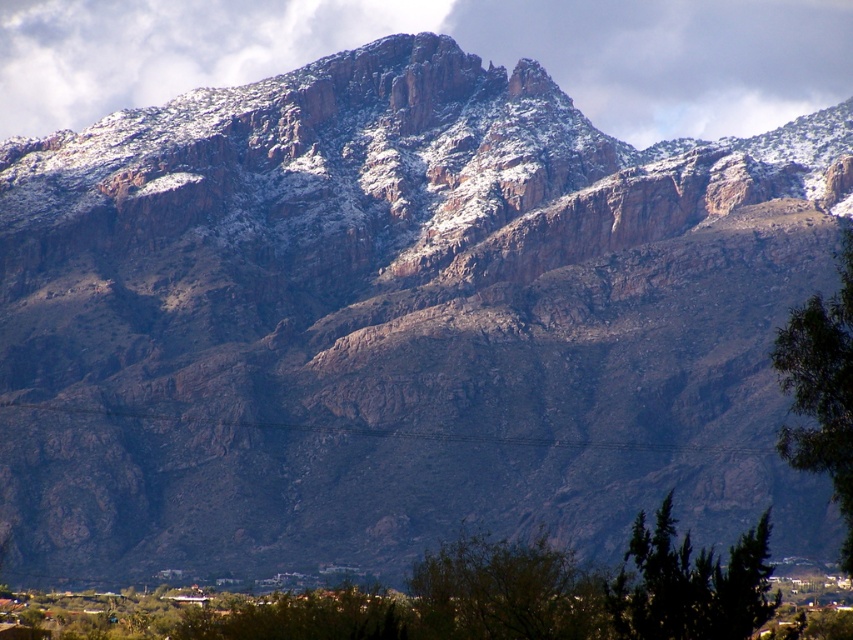
You are a hiker trying to navigate through the mountain trail. You see a dark green coniferous tree at lower right and a green leafy tree at right. Which tree is closer to the left side of the path?

The dark green coniferous tree at lower right is positioned on the left side of green leafy tree at right, so it is closer to the left side of the path.

You are a hiker planning to navigate through the mountain terrain. You notice a green leafy tree at lower center and a dark green coniferous tree at lower right. Which tree should you head towards if you want to stay closer to the path that runs along the base of the mountains?

The dark green coniferous tree at lower right is to the right of the green leafy tree at lower center. Since the path likely follows the base, heading toward the dark green coniferous tree at lower right would keep you closer to the path.